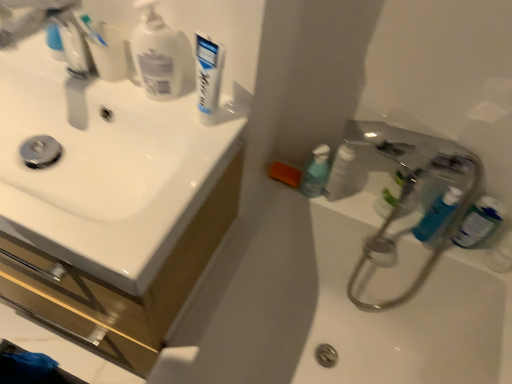
At what (x,y) coordinates should I click in order to perform the action: click on free space that is in between blue translucent bottle at right, which is the 2th toiletry from left to right, and white glossy toothpaste tube at right, which is counted as the first toiletry, starting from the left. Please return your answer as a coordinate pair (x, y). This screenshot has width=512, height=384. Looking at the image, I should click on (373, 212).